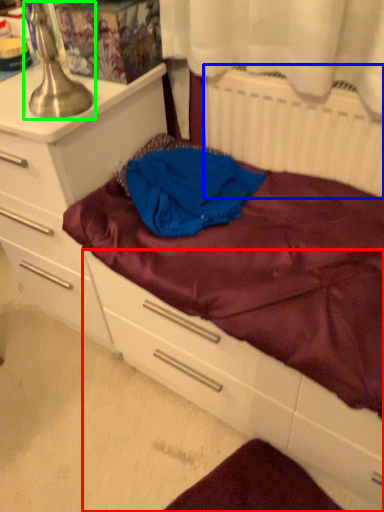
Question: Which object is the farthest from drawer (highlighted by a red box)? Choose among these: radiator (highlighted by a blue box) or table lamp (highlighted by a green box).

Choices:
 (A) radiator
 (B) table lamp

Answer: (B)